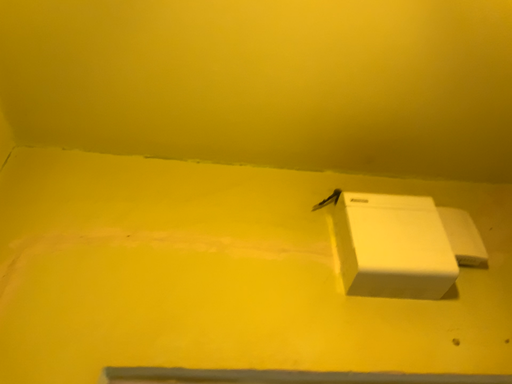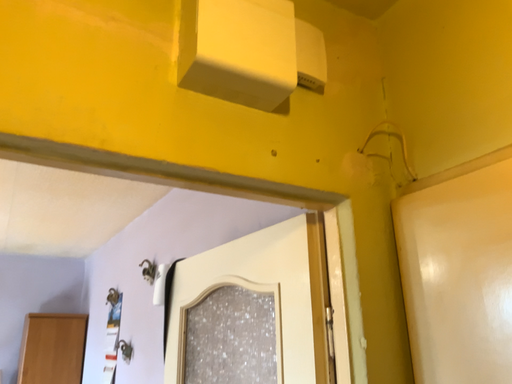
Question: Which way did the camera rotate in the video?

Choices:
 (A) rotated downward
 (B) rotated upward

Answer: (A)